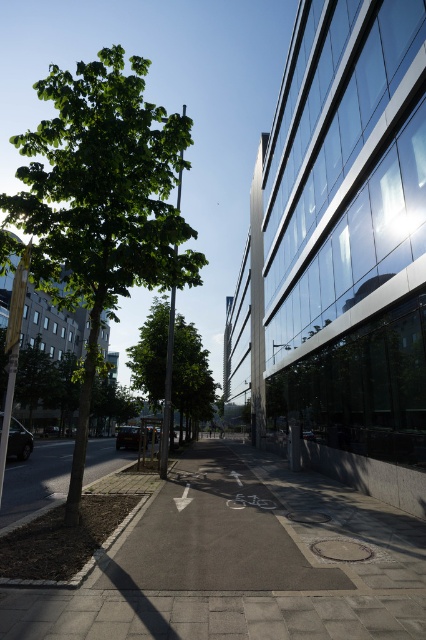
Question: Which point is farther from the camera taking this photo?

Choices:
 (A) (152, 220)
 (B) (181, 412)
 (C) (186, 496)

Answer: (B)

Question: Is gray asphalt at center smaller than green leafy tree at left?

Choices:
 (A) no
 (B) yes

Answer: (B)

Question: Which point appears farthest from the camera in this image?

Choices:
 (A) (196, 353)
 (B) (86, 413)

Answer: (A)

Question: Can you confirm if gray asphalt at center is smaller than green leafy tree at center?

Choices:
 (A) no
 (B) yes

Answer: (B)

Question: Which is farther from the green leafy tree at left?

Choices:
 (A) green leafy tree at center
 (B) gray asphalt at center

Answer: (B)

Question: Can you confirm if green leafy tree at left is wider than green leafy tree at center?

Choices:
 (A) yes
 (B) no

Answer: (A)